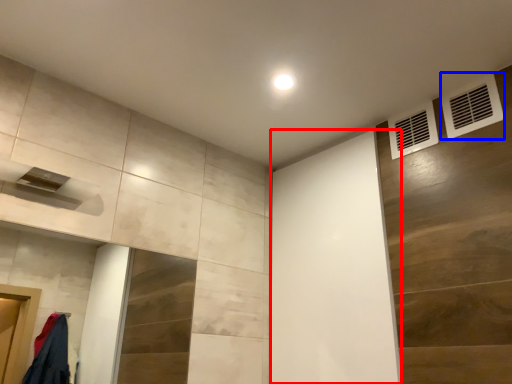
Question: Which object is closer to the camera taking this photo, screen door (highlighted by a red box) or air conditioning (highlighted by a blue box)?

Choices:
 (A) screen door
 (B) air conditioning

Answer: (B)